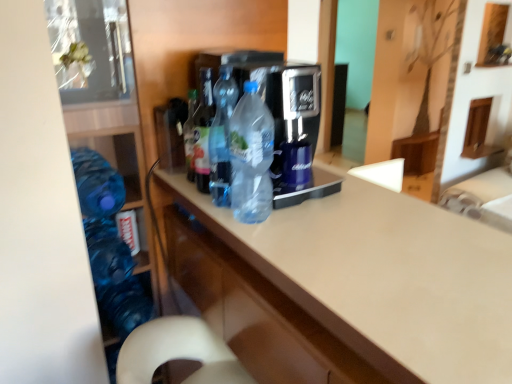
Find the location of a particular element. Image resolution: width=512 pixels, height=384 pixels. vacant region to the left of translucent plastic bottle at center, which appears as the 4th bottle when viewed from the left is located at coordinates (211, 211).